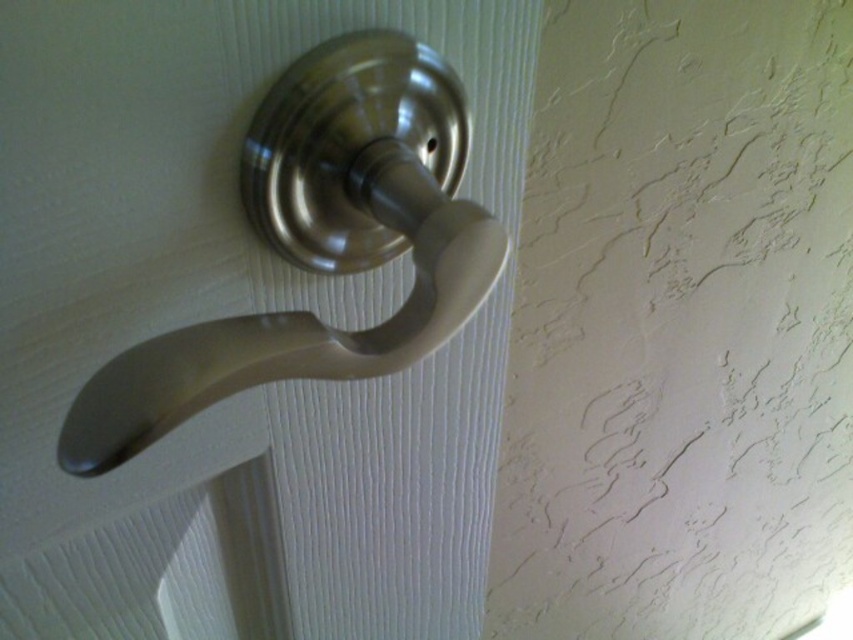
You are trying to locate the satin nickel handle at center in the image. According to the coordinates provided, where exactly is it positioned?

The satin nickel handle at center is located at point coordinates of (252, 328).

You are trying to open the door but are confused about which part to use. The satin nickel handle at center and the satin nickel knob at center are both there. Which one is closer to you?

The satin nickel handle at center is closer to the viewer than the satin nickel knob at center, so you should use the satin nickel handle at center to open the door.

You are trying to open the door but are confused about which part to use. You see a satin nickel handle at center and a satin nickel knob at center. Which one is on the left side?

The satin nickel handle at center is positioned on the left side of the satin nickel knob at center.